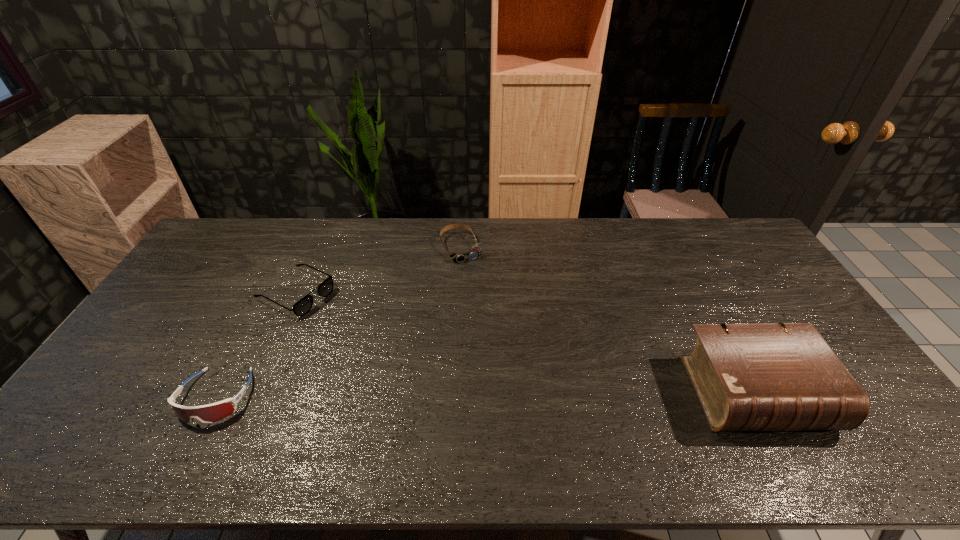
At what (x,y) coordinates should I click in order to perform the action: click on vacant space that's between the left goggles and the third nearest object. Please return your answer as a coordinate pair (x, y). The width and height of the screenshot is (960, 540). Looking at the image, I should click on (256, 345).

Find the location of a particular element. The image size is (960, 540). vacant region between the spectacles and the shorter goggles is located at coordinates tap(379, 270).

Select which object is the closest to the second farthest object. Please provide its 2D coordinates. Your answer should be formatted as a tuple, i.e. [(x, y)], where the tuple contains the x and y coordinates of a point satisfying the conditions above.

[(209, 413)]

Select which object is the third closest to the spectacles. Please provide its 2D coordinates. Your answer should be formatted as a tuple, i.e. [(x, y)], where the tuple contains the x and y coordinates of a point satisfying the conditions above.

[(778, 376)]